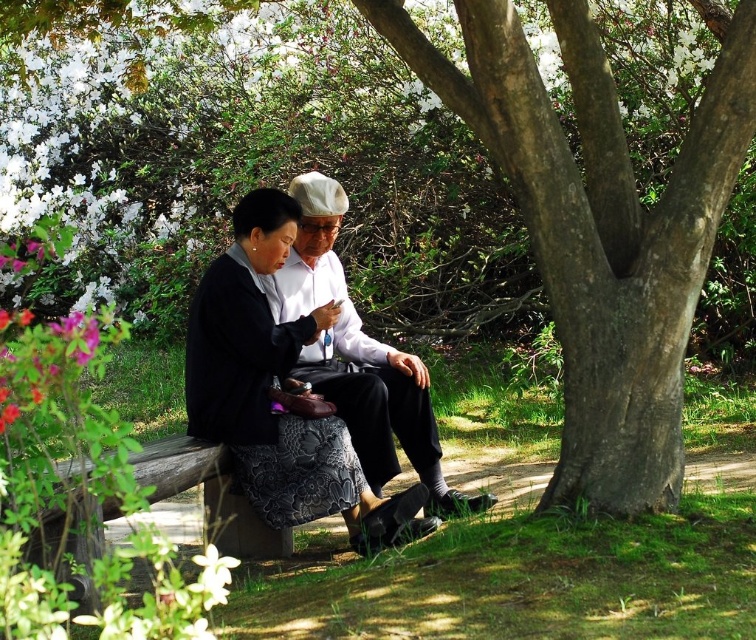
What do you see at coordinates (600, 228) in the screenshot? I see `smooth bark tree at center` at bounding box center [600, 228].

Does smooth bark tree at center have a lesser height compared to matte black jacket at center?

In fact, smooth bark tree at center may be taller than matte black jacket at center.

Is point (606, 342) behind point (268, 236)?

No, (606, 342) is closer to viewer.

Locate an element on the screen. This screenshot has width=756, height=640. smooth bark tree at center is located at coordinates (600, 228).

Does white cotton shirt at center have a greater width compared to white matte flower at lower center?

Correct, the width of white cotton shirt at center exceeds that of white matte flower at lower center.

Is point (315, 348) positioned in front of point (209, 544)?

That is False.

At what (x,y) coordinates should I click in order to perform the action: click on white cotton shirt at center. Please return your answer as a coordinate pair (x, y). This screenshot has width=756, height=640. Looking at the image, I should click on (361, 358).

Where is `white cotton shirt at center`? white cotton shirt at center is located at coordinates (361, 358).

Is matte black jacket at center wider than white matte flower at lower center?

Yes, matte black jacket at center is wider than white matte flower at lower center.

Between matte black jacket at center and white matte flower at lower center, which one is positioned higher?

matte black jacket at center is above.

Where is `matte black jacket at center`? The width and height of the screenshot is (756, 640). matte black jacket at center is located at coordinates (277, 388).